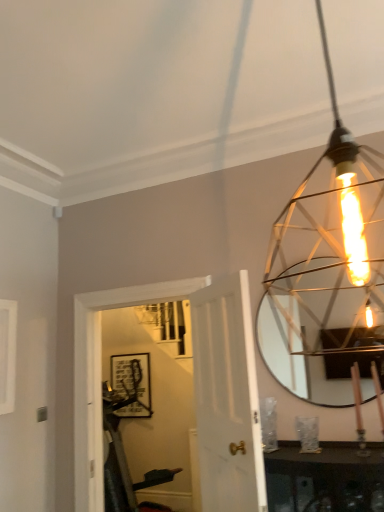
Question: Does point (281, 354) appear closer or farther from the camera than point (210, 423)?

Choices:
 (A) closer
 (B) farther

Answer: (B)

Question: In terms of height, does metallic silver mirror at upper right look taller or shorter compared to white wood door at center?

Choices:
 (A) tall
 (B) short

Answer: (B)

Question: Which of these objects is positioned farthest from the metallic silver mirror at upper right?

Choices:
 (A) matte gold wire cage at upper right
 (B) matte black picture frame at center
 (C) white wood door at center

Answer: (B)

Question: Based on their relative distances, which object is farther from the metallic silver mirror at upper right?

Choices:
 (A) matte gold wire cage at upper right
 (B) white wood door at center
 (C) matte black picture frame at center

Answer: (C)